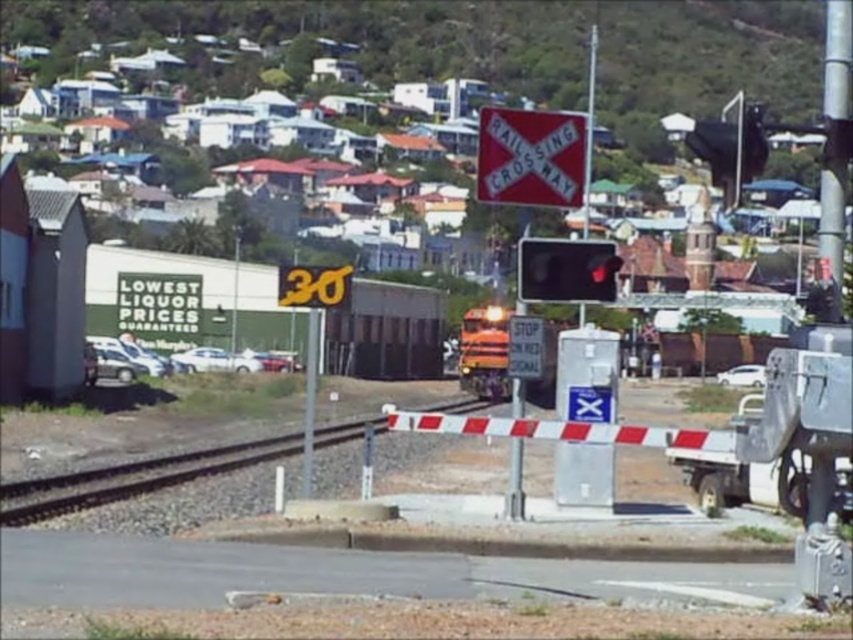
Question: Is smooth metal tracks at center bigger than metallic traffic light at center?

Choices:
 (A) no
 (B) yes

Answer: (B)

Question: Can you confirm if red plastic railroad crossing sign at center is positioned below matte black traffic light at center?

Choices:
 (A) no
 (B) yes

Answer: (A)

Question: Which object is the farthest from the red plastic railroad crossing sign at center?

Choices:
 (A) matte black traffic light at center
 (B) smooth metal tracks at center
 (C) metallic traffic light at center
 (D) white plastic stop sign at center

Answer: (B)

Question: Is red plastic railroad crossing sign at center bigger than metallic traffic light at center?

Choices:
 (A) no
 (B) yes

Answer: (A)

Question: Which point is closer to the camera taking this photo?

Choices:
 (A) (39, 481)
 (B) (523, 340)

Answer: (B)

Question: Estimate the real-world distances between objects in this image. Which object is closer to the metallic traffic light at center?

Choices:
 (A) white plastic stop sign at center
 (B) matte black traffic light at center
 (C) red plastic railroad crossing sign at center

Answer: (B)